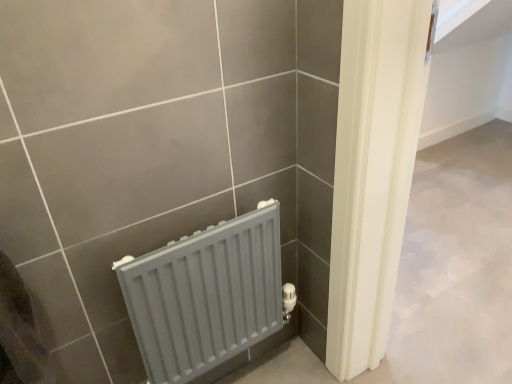
Question: From their relative heights in the image, would you say matte plastic towel at lower left is taller or shorter than gray matte radiator at lower left?

Choices:
 (A) tall
 (B) short

Answer: (B)

Question: Is matte plastic towel at lower left bigger or smaller than gray matte radiator at lower left?

Choices:
 (A) big
 (B) small

Answer: (B)

Question: Is point (5, 286) closer or farther from the camera than point (205, 334)?

Choices:
 (A) closer
 (B) farther

Answer: (A)

Question: Based on their sizes in the image, would you say gray matte radiator at lower left is bigger or smaller than matte plastic towel at lower left?

Choices:
 (A) small
 (B) big

Answer: (B)

Question: In the image, is gray matte radiator at lower left positioned in front of or behind matte plastic towel at lower left?

Choices:
 (A) behind
 (B) front

Answer: (A)

Question: Considering the positions of gray matte radiator at lower left and matte plastic towel at lower left in the image, is gray matte radiator at lower left taller or shorter than matte plastic towel at lower left?

Choices:
 (A) short
 (B) tall

Answer: (B)

Question: From a real-world perspective, is gray matte radiator at lower left above or below matte plastic towel at lower left?

Choices:
 (A) below
 (B) above

Answer: (A)